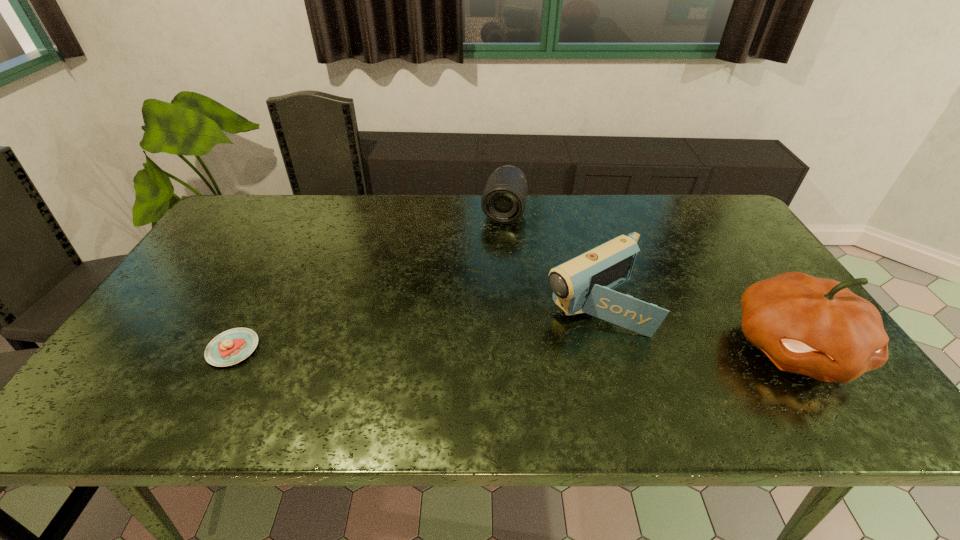
This screenshot has width=960, height=540. In the image, there is a desktop. In order to click on free region at the near edge in this screenshot , I will do `click(287, 364)`.

What are the coordinates of `free region at the right edge` in the screenshot? It's located at (737, 251).

The image size is (960, 540). In order to click on vacant space at the far left corner of the desktop in this screenshot , I will do `click(273, 199)`.

The width and height of the screenshot is (960, 540). I want to click on vacant space at the near right corner of the desktop, so click(x=816, y=382).

You are a GUI agent. You are given a task and a screenshot of the screen. Output one action in this format:
    pyautogui.click(x=<x>, y=<y>)
    Task: Click on the free space that is in between the shortest object and the telephoto lens
    The width and height of the screenshot is (960, 540).
    Given the screenshot: What is the action you would take?
    pyautogui.click(x=369, y=280)

Where is `blank region between the camcorder and the telephoto lens`? blank region between the camcorder and the telephoto lens is located at coordinates (549, 257).

The height and width of the screenshot is (540, 960). Identify the location of vacant space that is in between the third object from right to left and the camcorder. (549, 257).

Find the location of a particular element. blank region between the camcorder and the second shortest object is located at coordinates [549, 257].

Locate an element on the screen. The width and height of the screenshot is (960, 540). empty location between the camcorder and the farthest object is located at coordinates (549, 257).

Where is `vacant area that lies between the rightmost object and the second object from left to right`? vacant area that lies between the rightmost object and the second object from left to right is located at coordinates (649, 280).